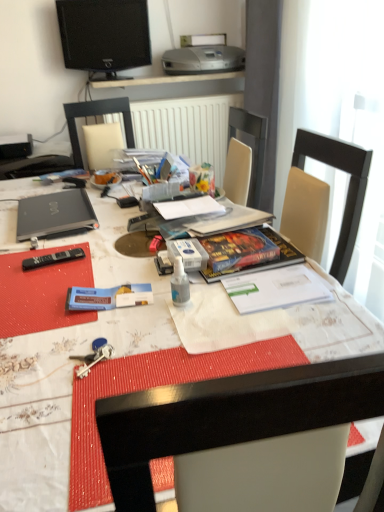
What do you see at coordinates (203, 56) in the screenshot? The height and width of the screenshot is (512, 384). I see `silver metallic printer at upper center` at bounding box center [203, 56].

This screenshot has width=384, height=512. Describe the element at coordinates (52, 258) in the screenshot. I see `black plastic remote control at lower left` at that location.

Where is `black plastic remote control at lower left`? The image size is (384, 512). black plastic remote control at lower left is located at coordinates (52, 258).

In order to face transparent plastic spray bottle at center, should I rotate leftwards or rightwards?

Rotate left and turn 1.805 degrees.

Locate an element on the screen. black matte laptop at left is located at coordinates (54, 214).

Would you consider transparent plastic spray bottle at center to be distant from black plastic remote control at lower left?

transparent plastic spray bottle at center is near black plastic remote control at lower left, not far away.

From the image's perspective, does transparent plastic spray bottle at center appear higher than black plastic remote control at lower left?

No, from the image's perspective, transparent plastic spray bottle at center is not on top of black plastic remote control at lower left.

From a real-world perspective, who is located higher, transparent plastic spray bottle at center or black plastic remote control at lower left?

transparent plastic spray bottle at center, from a real-world perspective.

Relative to black plastic remote control at lower left, is transparent plastic spray bottle at center in front or behind?

Clearly, transparent plastic spray bottle at center is in front of black plastic remote control at lower left.

Which is further, (x=174, y=214) or (x=104, y=332)?

The point (x=174, y=214) is farther.

Does white paper at center appear on the right side of white glossy desk at center?

Yes, white paper at center is to the right of white glossy desk at center.

Is transparent plastic spray bottle at center thinner than white paper at center?

Yes.

From the image's perspective, which is above, transparent plastic spray bottle at center or white paper at center?

From the image's view, white paper at center is above.

From their relative heights in the image, would you say transparent plastic spray bottle at center is taller or shorter than white paper at center?

In the image, transparent plastic spray bottle at center appears to be taller than white paper at center.

From the image's perspective, is transparent plastic spray bottle at center below silver metallic printer at upper center?

Indeed, from the image's perspective, transparent plastic spray bottle at center is shown beneath silver metallic printer at upper center.

In the scene shown: From a real-world perspective, is transparent plastic spray bottle at center on top of silver metallic printer at upper center?

No, from a real-world perspective, transparent plastic spray bottle at center is not on top of silver metallic printer at upper center.

Is transparent plastic spray bottle at center aimed at silver metallic printer at upper center?

No, transparent plastic spray bottle at center is not facing towards silver metallic printer at upper center.

Is point (180, 261) behind point (167, 71)?

No.

From a real-world perspective, is white glossy desk at center located higher than silver metallic printer at upper center?

Incorrect, from a real-world perspective, white glossy desk at center is lower than silver metallic printer at upper center.

Considering the sizes of white glossy desk at center and silver metallic printer at upper center in the image, is white glossy desk at center bigger or smaller than silver metallic printer at upper center?

Considering their sizes, white glossy desk at center takes up more space than silver metallic printer at upper center.

The height and width of the screenshot is (512, 384). Find the location of `desk that is below the silver metallic printer at upper center (from the image's perspective)`. desk that is below the silver metallic printer at upper center (from the image's perspective) is located at coordinates (69, 369).

Which object is closer to the camera taking this photo, white glossy desk at center or silver metallic printer at upper center?

white glossy desk at center is more forward.

Can you confirm if black glossy television at upper center is bigger than transparent plastic spray bottle at center?

Correct, black glossy television at upper center is larger in size than transparent plastic spray bottle at center.

Is point (81, 54) closer or farther from the camera than point (183, 291)?

Point (81, 54) is positioned farther from the camera compared to point (183, 291).

Which object is thinner, black glossy television at upper center or transparent plastic spray bottle at center?

Thinner between the two is transparent plastic spray bottle at center.

Is white paper at center facing towards black glossy television at upper center?

No.

From a real-world perspective, which is physically above, white paper at center or black glossy television at upper center?

From a 3D spatial view, black glossy television at upper center is above.

From the image's perspective, which one is positioned higher, white paper at center or black glossy television at upper center?

From the image's view, black glossy television at upper center is above.

I want to click on bottle located on the right of black plastic remote control at lower left, so click(x=179, y=284).

This screenshot has height=512, width=384. I want to click on notebook located above the white glossy desk at center (from a real-world perspective), so click(x=189, y=207).

Based on their spatial positions, is transparent plastic spray bottle at center or black plastic remote control at lower left further from white glossy desk at center?

black plastic remote control at lower left is further to white glossy desk at center.

Which object lies further to the anchor point black glossy television at upper center, white glossy desk at center or white paper at center?

Based on the image, white paper at center appears to be further to black glossy television at upper center.

Which object lies further to the anchor point white paper at center, black plastic remote control at lower left or black matte laptop at left?

black plastic remote control at lower left is positioned further to the anchor white paper at center.

From the image, which object appears to be nearer to black matte laptop at left, transparent plastic spray bottle at center or white glossy desk at center?

white glossy desk at center.

Estimate the real-world distances between objects in this image. Which object is closer to white glossy desk at center, black matte laptop at left or black plastic remote control at lower left?

black matte laptop at left is positioned closer to the anchor white glossy desk at center.

Which object lies further to the anchor point transparent plastic spray bottle at center, white paper at center or black matte laptop at left?

The object further to transparent plastic spray bottle at center is black matte laptop at left.

From the image, which object appears to be farther from transparent plastic spray bottle at center, black plastic remote control at lower left or white paper at center?

black plastic remote control at lower left.

When comparing their distances from black matte laptop at left, does black plastic remote control at lower left or transparent plastic spray bottle at center seem further?

Based on the image, transparent plastic spray bottle at center appears to be further to black matte laptop at left.

Find the location of `notebook between black glossy television at upper center and black plastic remote control at lower left vertically`. notebook between black glossy television at upper center and black plastic remote control at lower left vertically is located at coordinates pyautogui.click(x=189, y=207).

Locate an element on the screen. remote control between white glossy desk at center and silver metallic printer at upper center from front to back is located at coordinates (52, 258).

This screenshot has width=384, height=512. What are the coordinates of `notebook between white glossy desk at center and black glossy television at upper center from front to back` in the screenshot? It's located at (189, 207).

The image size is (384, 512). Identify the location of bottle positioned between white glossy desk at center and black plastic remote control at lower left from near to far. (179, 284).